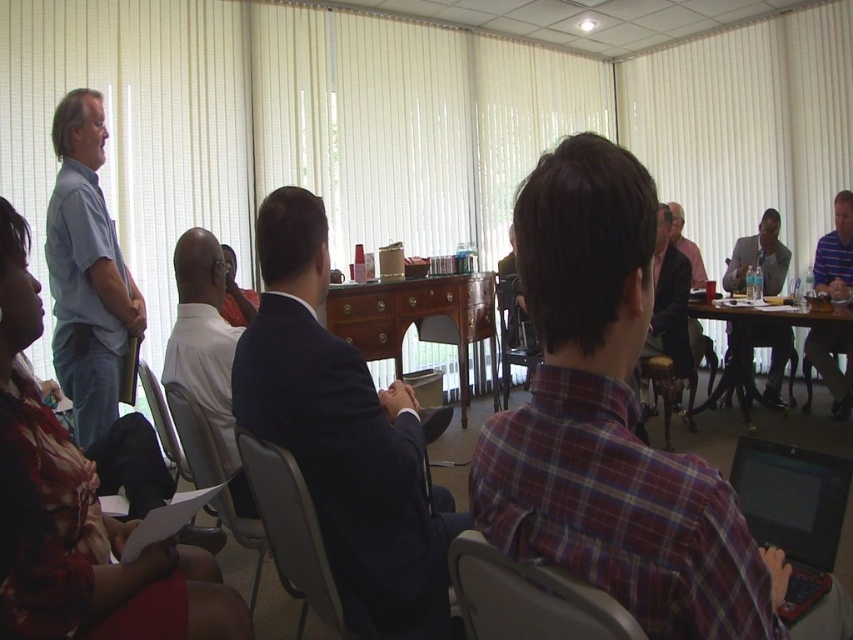
Question: Considering the relative positions of striped polo shirt at right and light gray suit at right in the image provided, where is striped polo shirt at right located with respect to light gray suit at right?

Choices:
 (A) right
 (B) left

Answer: (A)

Question: Based on their relative distances, which object is nearer to the gray fabric chair at lower left?

Choices:
 (A) striped polo shirt at right
 (B) gray fabric chair at center
 (C) plaid fabric shirt at center
 (D) black plastic laptop at lower right

Answer: (B)

Question: Is light blue shirt at left in front of dark blue suit at center?

Choices:
 (A) yes
 (B) no

Answer: (A)

Question: Which of the following is the farthest from the observer?

Choices:
 (A) (405, 307)
 (B) (764, 624)
 (C) (137, 291)
 (D) (750, 240)

Answer: (D)

Question: Which object is closer to the camera taking this photo?

Choices:
 (A) dark blue suit at center
 (B) pink fabric shirt at center
 (C) wooden chair at center

Answer: (A)

Question: Is black plastic laptop at lower right above pink fabric shirt at center?

Choices:
 (A) yes
 (B) no

Answer: (B)